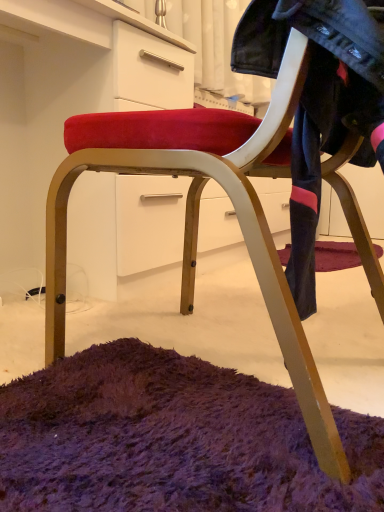
What is the approximate height of denim jacket at upper right?

The height of denim jacket at upper right is 24.05 inches.

The width and height of the screenshot is (384, 512). Identify the location of denim jacket at upper right. (319, 102).

What do you see at coordinates (319, 102) in the screenshot? This screenshot has height=512, width=384. I see `denim jacket at upper right` at bounding box center [319, 102].

Locate an element on the screen. This screenshot has height=512, width=384. matte white dresser at center is located at coordinates (64, 100).

What do you see at coordinates (64, 100) in the screenshot? I see `matte white dresser at center` at bounding box center [64, 100].

I want to click on denim jacket at upper right, so click(319, 102).

Which is more to the right, denim jacket at upper right or matte white dresser at center?

Positioned to the right is denim jacket at upper right.

Is denim jacket at upper right positioned in front of matte white dresser at center?

Yes, the depth of denim jacket at upper right is less than that of matte white dresser at center.

Which is farther, (320, 46) or (89, 268)?

The point (89, 268) is farther.

From the image's perspective, is denim jacket at upper right below matte white dresser at center?

Yes, from the image's perspective, denim jacket at upper right is beneath matte white dresser at center.

From a real-world perspective, between denim jacket at upper right and matte white dresser at center, who is vertically lower?

In real-world perspective, matte white dresser at center is lower.

Considering the sizes of denim jacket at upper right and matte white dresser at center in the image, is denim jacket at upper right wider or thinner than matte white dresser at center?

In the image, denim jacket at upper right appears to be more narrow than matte white dresser at center.

Between denim jacket at upper right and matte white dresser at center, which one has less height?

Standing shorter between the two is denim jacket at upper right.

Considering the sizes of denim jacket at upper right and matte white dresser at center in the image, is denim jacket at upper right bigger or smaller than matte white dresser at center?

Considering their sizes, denim jacket at upper right takes up less space than matte white dresser at center.

Would you say matte white dresser at center is part of denim jacket at upper right's contents?

No, matte white dresser at center is not a part of denim jacket at upper right.

Are denim jacket at upper right and matte white dresser at center making contact?

No, denim jacket at upper right is not with matte white dresser at center.

Is denim jacket at upper right looking in the opposite direction of matte white dresser at center?

No.

How different are the orientations of denim jacket at upper right and matte white dresser at center in degrees?

They differ by 178 degrees in their facing directions.

Consider the image. Measure the distance between denim jacket at upper right and matte white dresser at center.

denim jacket at upper right and matte white dresser at center are 28.54 inches apart from each other.

I want to click on dresser behind the denim jacket at upper right, so [64, 100].

Which object is positioned more to the left, matte white dresser at center or denim jacket at upper right?

Positioned to the left is matte white dresser at center.

Considering the positions of objects matte white dresser at center and denim jacket at upper right in the image provided, who is behind, matte white dresser at center or denim jacket at upper right?

matte white dresser at center.

Does point (83, 54) lie behind point (346, 75)?

Yes, it is behind point (346, 75).

From the image's perspective, is matte white dresser at center above or below denim jacket at upper right?

matte white dresser at center is above denim jacket at upper right.

From a real-world perspective, between matte white dresser at center and denim jacket at upper right, who is vertically higher?

In real-world perspective, denim jacket at upper right is above.

Which object is thinner, matte white dresser at center or denim jacket at upper right?

Thinner between the two is denim jacket at upper right.

Is matte white dresser at center taller or shorter than denim jacket at upper right?

In the image, matte white dresser at center appears to be taller than denim jacket at upper right.

Considering the relative sizes of matte white dresser at center and denim jacket at upper right in the image provided, is matte white dresser at center smaller than denim jacket at upper right?

No.

Is matte white dresser at center not within denim jacket at upper right?

That's correct, matte white dresser at center is outside of denim jacket at upper right.

Are matte white dresser at center and denim jacket at upper right making contact?

matte white dresser at center and denim jacket at upper right are not in contact.

Does matte white dresser at center turn towards denim jacket at upper right?

Yes, matte white dresser at center is aimed at denim jacket at upper right.

What's the angular difference between matte white dresser at center and denim jacket at upper right's facing directions?

The facing directions of matte white dresser at center and denim jacket at upper right are 178 degrees apart.

How distant is matte white dresser at center from denim jacket at upper right?

matte white dresser at center and denim jacket at upper right are 28.54 inches apart from each other.

Find the location of a particular element. clothing above the matte white dresser at center (from a real-world perspective) is located at coordinates (319, 102).

The image size is (384, 512). Find the location of `clothing that appears above the matte white dresser at center (from a real-world perspective)`. clothing that appears above the matte white dresser at center (from a real-world perspective) is located at coordinates [319, 102].

Identify the location of clothing on the right of matte white dresser at center. (319, 102).